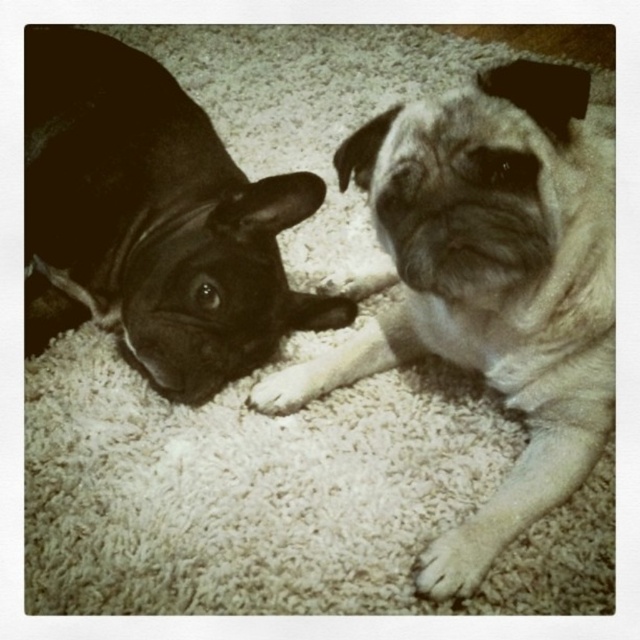
You are a dog owner who wants to buy a new dog bed for your pets. The bed you chose is designed to fit medium to large dogs. You have two dogs in the image, the fuzzy beige pug at center and the white fur at lower right. Which dog would you recommend placing the bed for based on their size?

The fuzzy beige pug at center is larger in size than the white fur at lower right, so the bed designed for medium to large dogs would be suitable for the fuzzy beige pug at center.

You are a photographer trying to capture a closeup of the fuzzy beige pug at center. You are currently standing at the point marked by the coordinates point (499,260). Is this the correct location to take the photo?

The point (499,260) marks fuzzy beige pug at center, so yes, standing at point (499,260) is the correct location to take the closeup of the fuzzy beige pug at center.